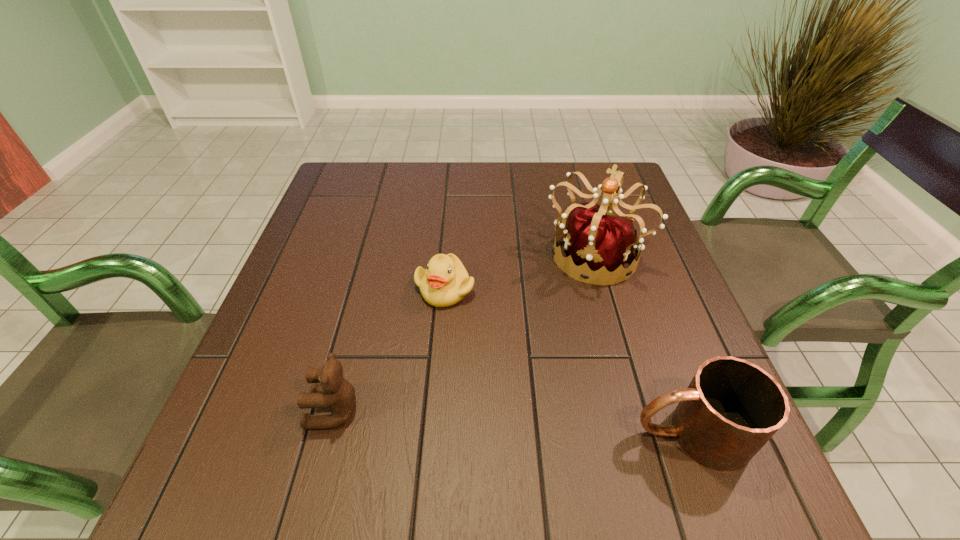
Identify the location of the leftmost object. (335, 392).

You are a GUI agent. You are given a task and a screenshot of the screen. Output one action in this format:
    pyautogui.click(x=<x>, y=<y>)
    Task: Click on the mug
    
    Given the screenshot: What is the action you would take?
    pyautogui.click(x=731, y=408)

The width and height of the screenshot is (960, 540). Identify the location of the tallest object. (598, 239).

The height and width of the screenshot is (540, 960). I want to click on the second object from left to right, so click(x=445, y=282).

What are the coordinates of `duckling` in the screenshot? It's located at (445, 282).

Identify the location of vacant space situated 0.120m on the face of the teddy bear. (243, 410).

Identify the location of vacant space situated 0.090m on the face of the teddy bear. (259, 410).

The height and width of the screenshot is (540, 960). I want to click on vacant space located on the face of the teddy bear, so click(276, 410).

Find the location of a particular element. The image size is (960, 540). free location located on the side of the mug with the handle is located at coordinates (521, 434).

Where is `vacant region located 0.210m on the side of the mug with the handle`? vacant region located 0.210m on the side of the mug with the handle is located at coordinates (509, 434).